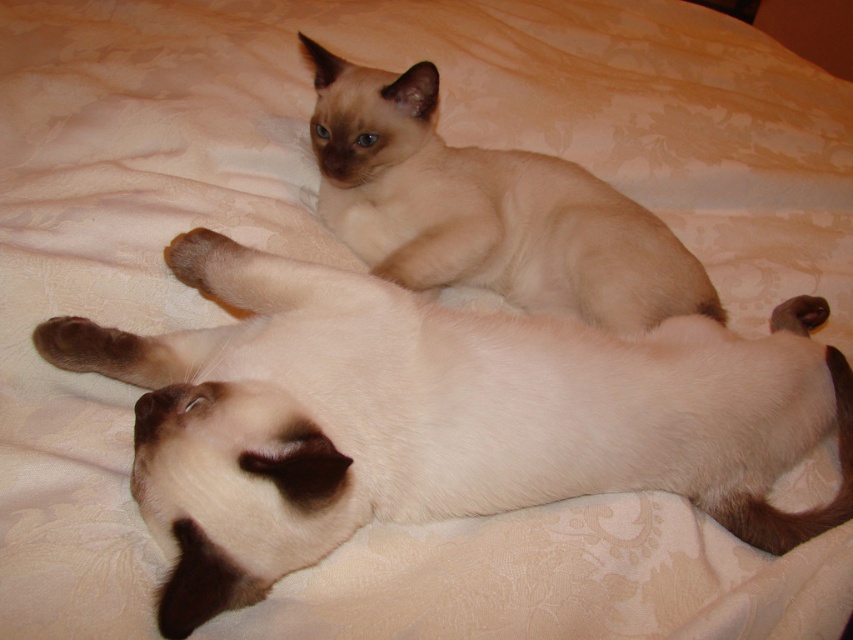
Is matte cream cat at center to the right of light brown fur cat at upper center from the viewer's perspective?

Indeed, matte cream cat at center is positioned on the right side of light brown fur cat at upper center.

Describe the element at coordinates (436, 417) in the screenshot. Image resolution: width=853 pixels, height=640 pixels. I see `matte cream cat at center` at that location.

Is point (163, 500) closer to viewer compared to point (483, 227)?

Yes, point (163, 500) is closer to viewer.

Identify the location of matte cream cat at center. The width and height of the screenshot is (853, 640). coord(436,417).